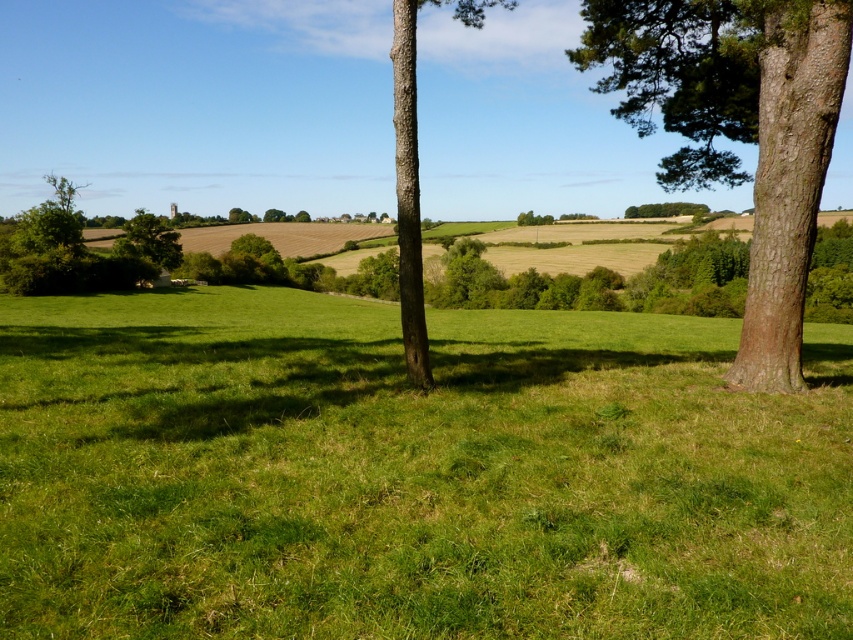
Is green grass at center below brown rough bark tree at center?

Yes, green grass at center is below brown rough bark tree at center.

Does green grass at center appear on the left side of brown rough bark tree at center?

Incorrect, green grass at center is not on the left side of brown rough bark tree at center.

Locate an element on the screen. The height and width of the screenshot is (640, 853). green grass at center is located at coordinates (410, 474).

Does green grass at center have a lesser height compared to green leafy tree at left?

Indeed, green grass at center has a lesser height compared to green leafy tree at left.

Which of these two, green grass at center or green leafy tree at left, stands shorter?

With less height is green grass at center.

Who is more distant from viewer, (183, 365) or (149, 237)?

The point (149, 237) is more distant.

Find the location of `green grass at center`. green grass at center is located at coordinates (410, 474).

Between green leafy tree at left and green leafy tree at upper center, which one is positioned lower?

Positioned lower is green leafy tree at left.

Is green leafy tree at left wider than green leafy tree at upper center?

Incorrect, green leafy tree at left's width does not surpass green leafy tree at upper center's.

This screenshot has height=640, width=853. I want to click on green leafy tree at left, so click(x=149, y=241).